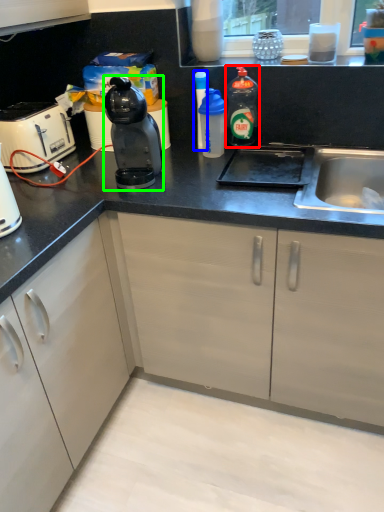
Question: Based on their relative distances, which object is nearer to bottle (highlighted by a red box)? Choose from bottle (highlighted by a blue box) and kitchen appliance (highlighted by a green box).

Choices:
 (A) bottle
 (B) kitchen appliance

Answer: (A)